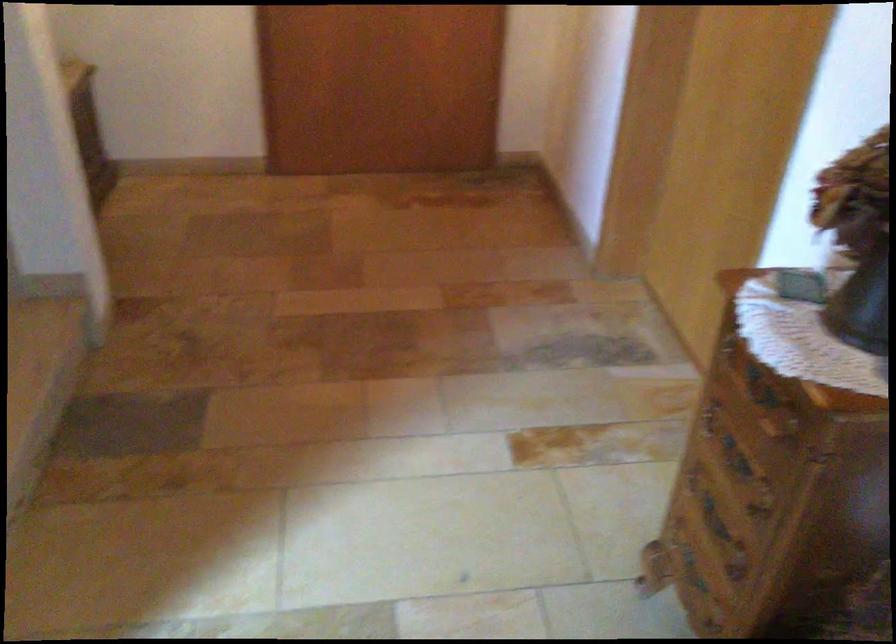
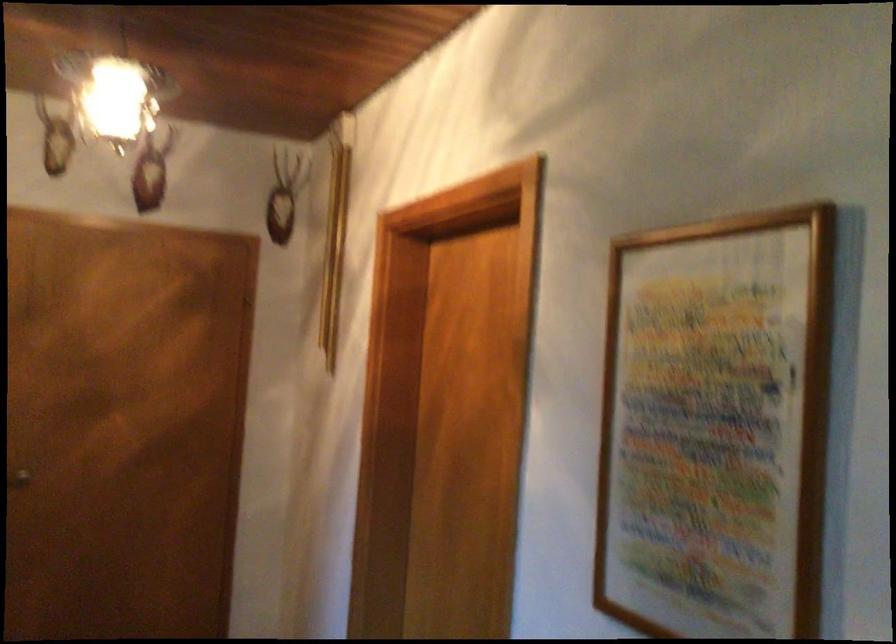
Based on the photo, based on the continuous images, in which direction is the camera rotating?

The camera rotated toward right-up.